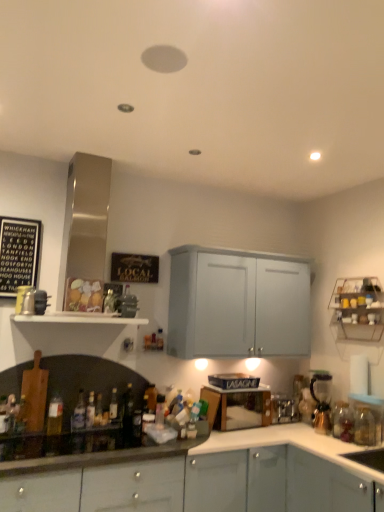
What are the coordinates of `vacant area that is situated to the right of translucent glass bottle at lower left, the 5th bottle from the left` in the screenshot? It's located at (108, 435).